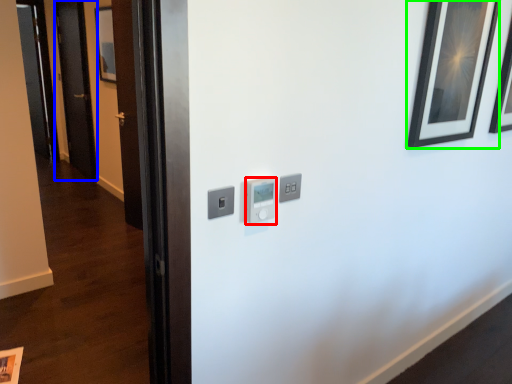
Question: Estimate the real-world distances between objects in this image. Which object is farther from light switch (highlighted by a red box), door (highlighted by a blue box) or picture frame (highlighted by a green box)?

Choices:
 (A) door
 (B) picture frame

Answer: (A)